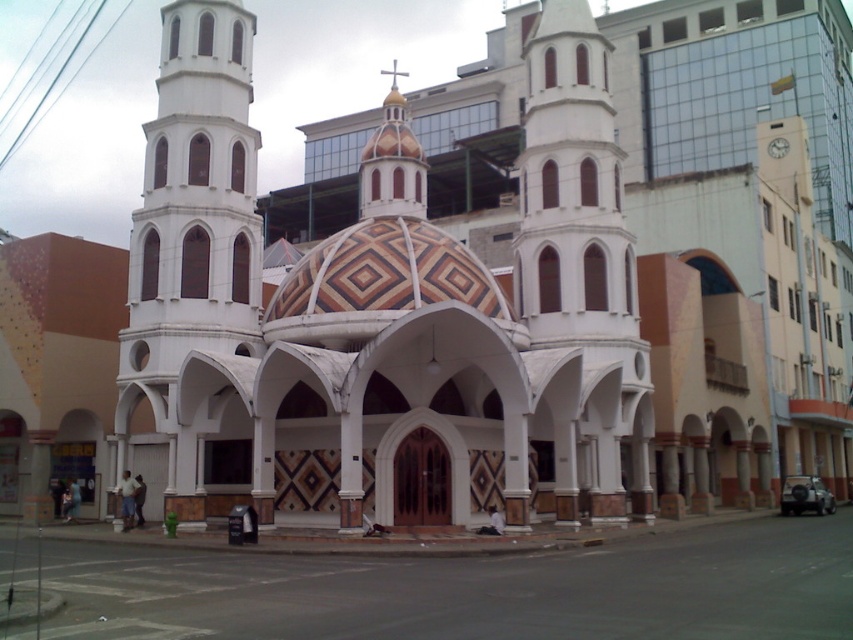
Question: Among these objects, which one is nearest to the camera?

Choices:
 (A) white marble tower at center
 (B) white smooth tower at center

Answer: (A)

Question: Can you confirm if white marble tower at center is positioned below white smooth tower at center?

Choices:
 (A) yes
 (B) no

Answer: (B)

Question: Can you confirm if white marble tower at center is positioned below white smooth tower at center?

Choices:
 (A) yes
 (B) no

Answer: (B)

Question: From the image, what is the correct spatial relationship of white marble tower at center in relation to white smooth tower at center?

Choices:
 (A) below
 (B) above

Answer: (B)

Question: Which of the following is the closest to the observer?

Choices:
 (A) white smooth tower at center
 (B) white marble tower at center

Answer: (B)